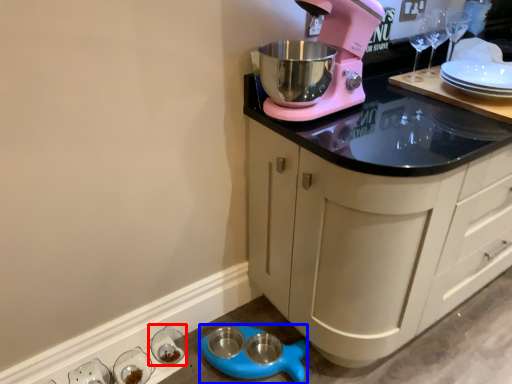
Question: Which point is further to the camera, tableware (highlighted by a red box) or appliance (highlighted by a blue box)?

Choices:
 (A) tableware
 (B) appliance

Answer: (A)